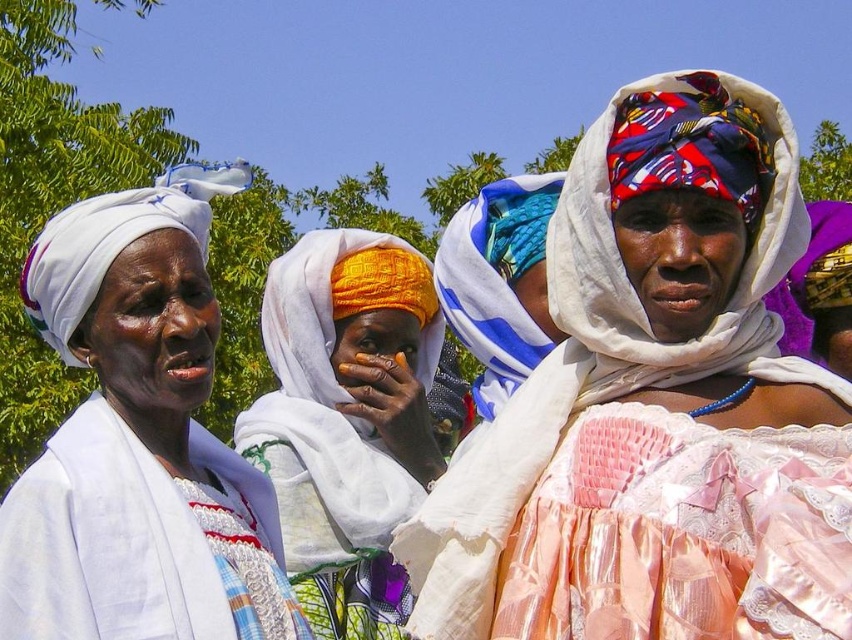
Question: Which object is farther from the camera taking this photo?

Choices:
 (A) shiny silk dress at center
 (B) matte yellow fabric headscarf at center
 (C) blue and white woven fabric at center

Answer: (C)

Question: Which of the following is the farthest from the observer?

Choices:
 (A) click(476, 387)
 (B) click(381, 305)
 (C) click(593, 305)

Answer: (B)

Question: Is shiny silk dress at center closer to camera compared to white woven cloth at left?

Choices:
 (A) no
 (B) yes

Answer: (B)

Question: Observing the image, what is the correct spatial positioning of white woven cloth at left in reference to matte yellow fabric headscarf at center?

Choices:
 (A) right
 (B) left

Answer: (B)

Question: Which point appears closest to the camera in this image?

Choices:
 (A) (194, 550)
 (B) (813, 400)
 (C) (471, 321)

Answer: (B)

Question: Is shiny silk dress at center to the left of white woven cloth at left from the viewer's perspective?

Choices:
 (A) yes
 (B) no

Answer: (B)